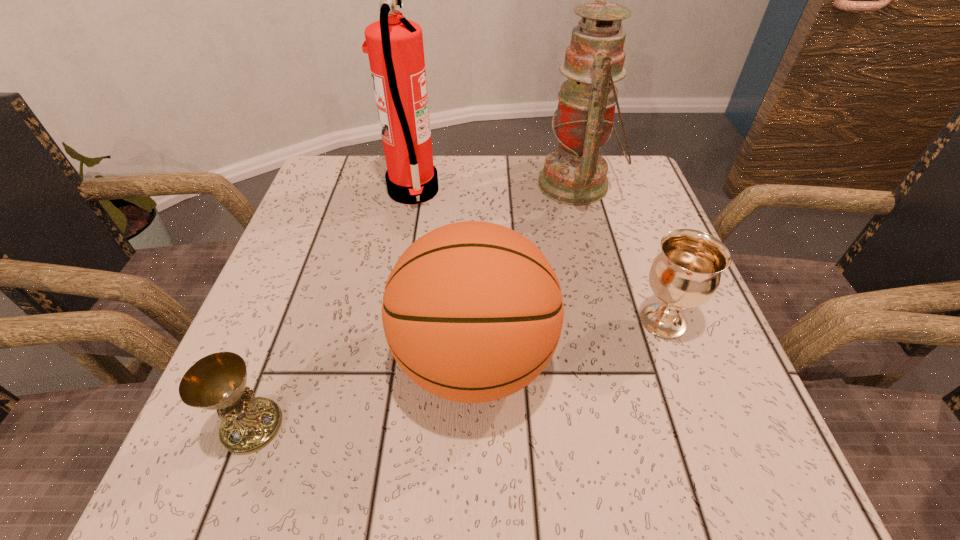
I want to click on fire extinguisher, so click(394, 45).

At what (x,y) coordinates should I click in order to perform the action: click on oil lamp. Please return your answer as a coordinate pair (x, y). The image size is (960, 540). Looking at the image, I should click on (575, 174).

You are a GUI agent. You are given a task and a screenshot of the screen. Output one action in this format:
    pyautogui.click(x=<x>, y=<y>)
    Task: Click on the basketball
    
    Given the screenshot: What is the action you would take?
    pyautogui.click(x=472, y=311)

Locate an element on the screen. The width and height of the screenshot is (960, 540). the taller chalice is located at coordinates (685, 274).

Locate an element on the screen. The height and width of the screenshot is (540, 960). the fourth tallest object is located at coordinates (685, 274).

You are a GUI agent. You are given a task and a screenshot of the screen. Output one action in this format:
    pyautogui.click(x=<x>, y=<y>)
    Task: Click on the nearer chalice
    This screenshot has height=540, width=960.
    Given the screenshot: What is the action you would take?
    pyautogui.click(x=218, y=381)

At what (x,y) coordinates should I click in order to perform the action: click on the shorter chalice. Please return your answer as a coordinate pair (x, y). This screenshot has height=540, width=960. Looking at the image, I should click on (218, 381).

Identify the location of free space located 0.300m with the nozzle aimed from the fire extinguisher. The width and height of the screenshot is (960, 540). 565,191.

Identify the location of vacant space situated 0.060m on the right of the oil lamp. The image size is (960, 540). (640, 185).

This screenshot has height=540, width=960. Find the location of `free region located 0.220m on the right of the basketball`. free region located 0.220m on the right of the basketball is located at coordinates (687, 361).